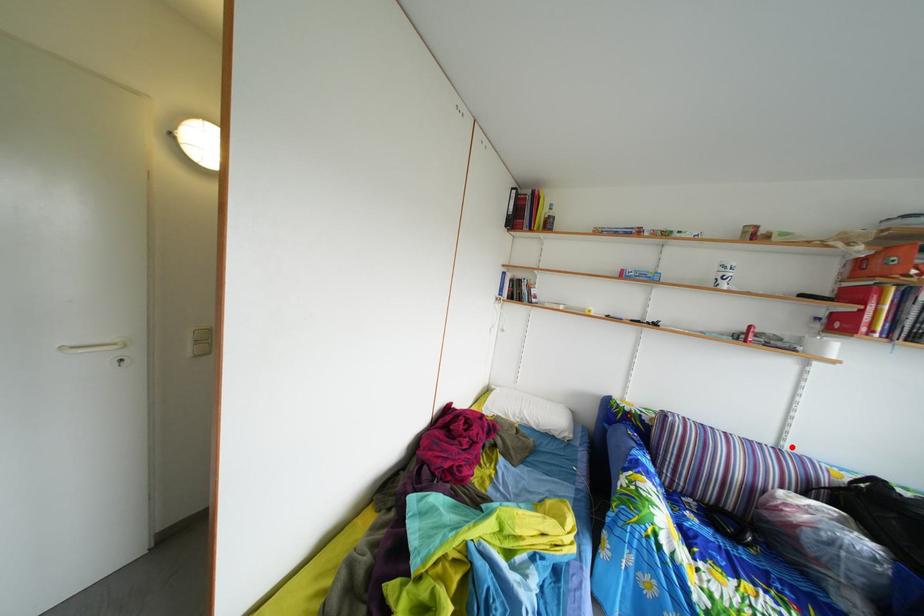
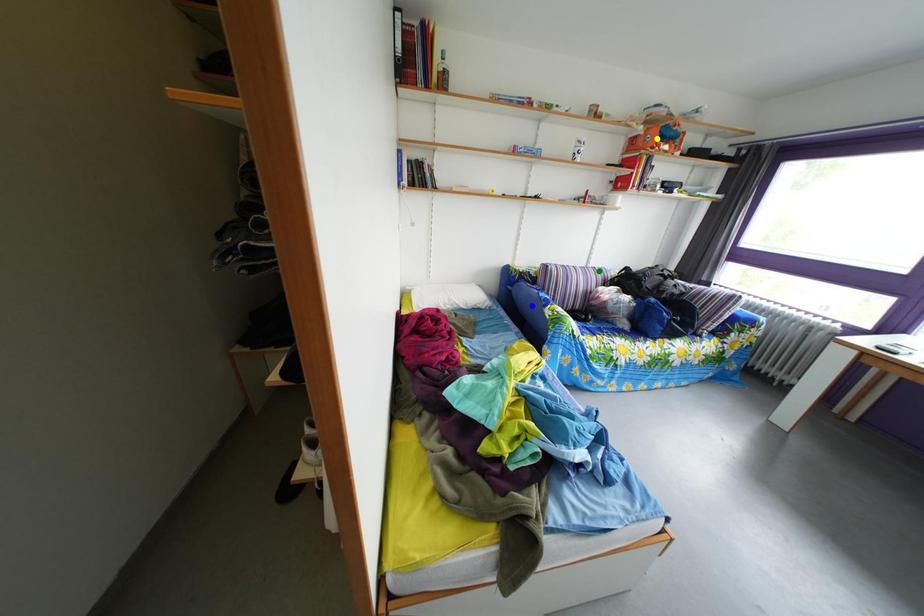
Question: I am providing you with two images of the same scene from different viewpoints. A red point is marked on the first image. You are given multiple points on the second image. Which point in image 2 is actually the same real-world point as the red point in image 1?

Choices:
 (A) blue point
 (B) yellow point
 (C) green point

Answer: (C)